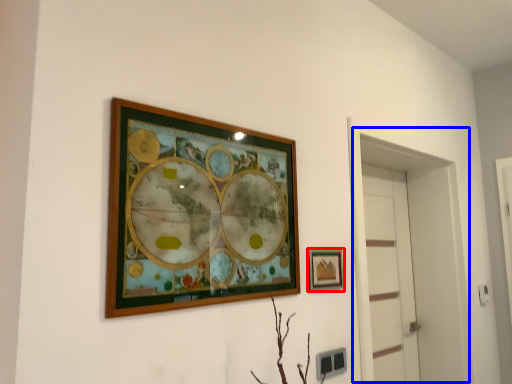
Question: Which object is further to the camera taking this photo, picture frame (highlighted by a red box) or glass door (highlighted by a blue box)?

Choices:
 (A) picture frame
 (B) glass door

Answer: (B)